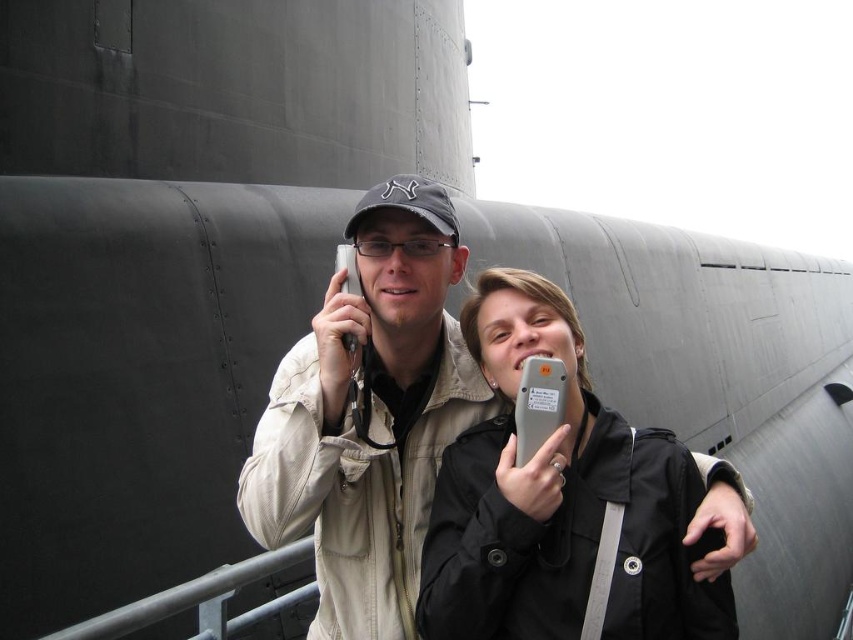
You are a photographer trying to capture a photo of both the black matte jacket at center and the matte beige jacket at center in the scene. Based on their positions, which jacket should you focus on first to ensure both are in frame?

The black matte jacket at center is below the matte beige jacket at center, so you should focus on the matte beige jacket at center first to ensure both are in frame.